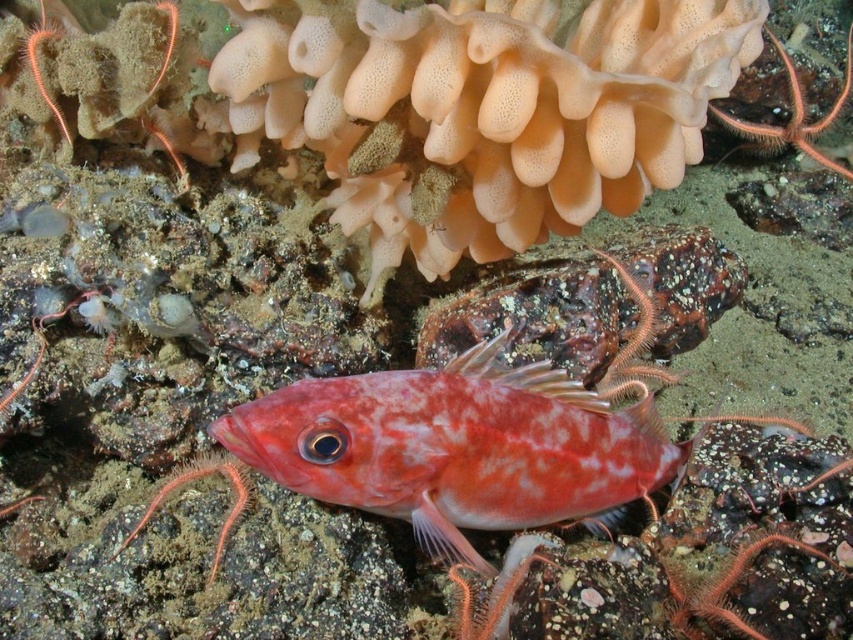
Question: Which point is closer to the camera taking this photo?

Choices:
 (A) (375, 513)
 (B) (563, 362)

Answer: (A)

Question: Is shiny pink fish at center below speckled rock at center?

Choices:
 (A) no
 (B) yes

Answer: (B)

Question: Does shiny pink fish at center come in front of speckled rock at center?

Choices:
 (A) yes
 (B) no

Answer: (A)

Question: Which point appears farthest from the camera in this image?

Choices:
 (A) (706, 264)
 (B) (509, 392)

Answer: (A)

Question: Is shiny pink fish at center to the left of speckled rock at center from the viewer's perspective?

Choices:
 (A) yes
 (B) no

Answer: (A)